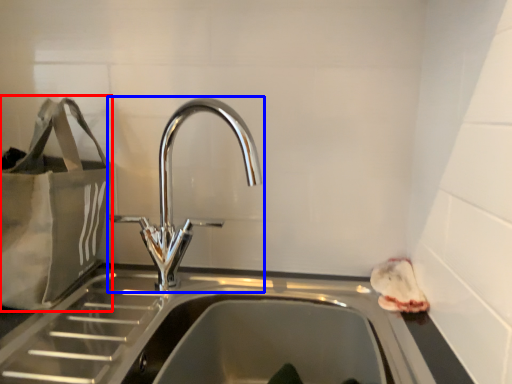
Question: Which object is closer to the camera taking this photo, bag (highlighted by a red box) or tap (highlighted by a blue box)?

Choices:
 (A) bag
 (B) tap

Answer: (B)